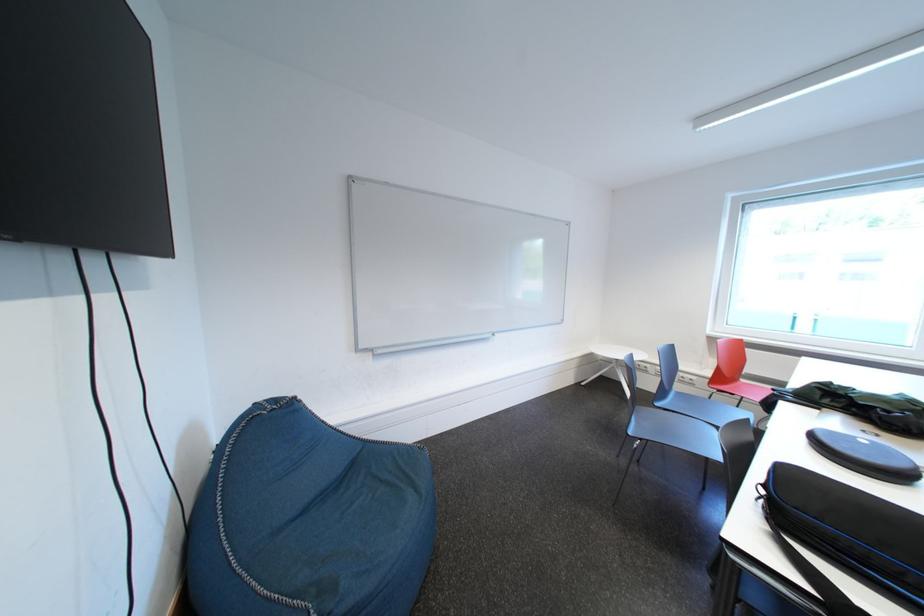
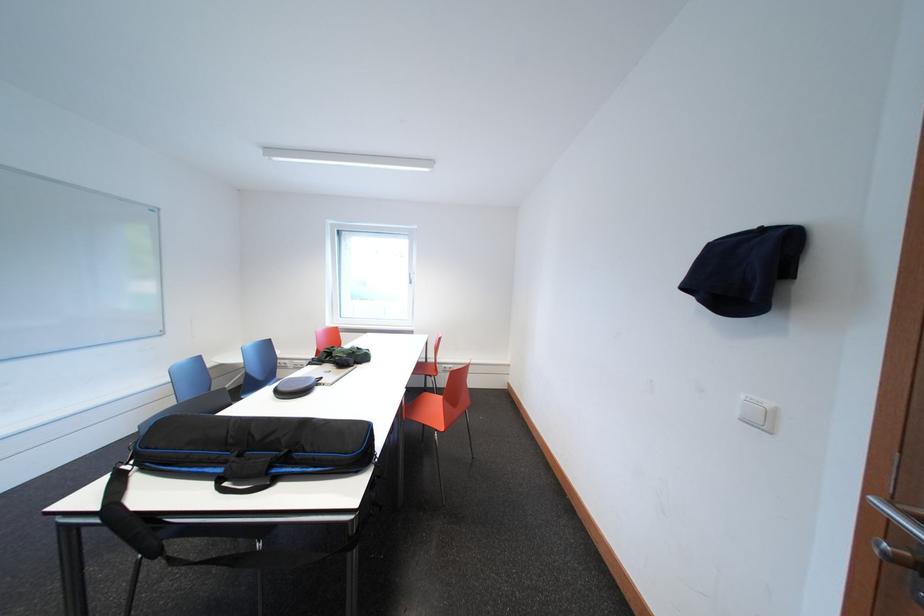
Question: The images are taken continuously from a first-person perspective. In which direction is your viewpoint rotating?

Choices:
 (A) Left
 (B) Right
 (C) Up
 (D) Down

Answer: (B)